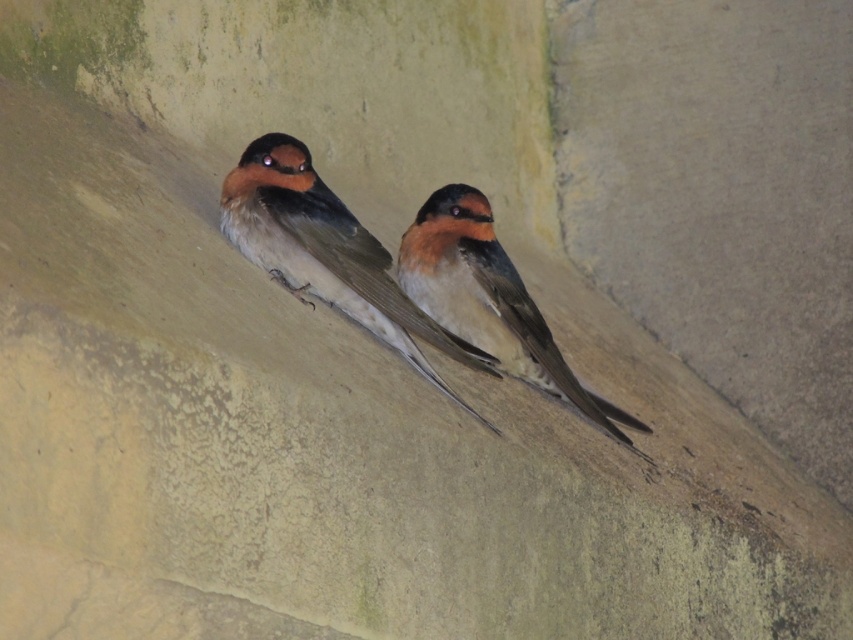
In the scene shown: Is brown feathered swallow at center positioned before brown matte swallow at center?

Yes, it is.

Where is `brown feathered swallow at center`? brown feathered swallow at center is located at coordinates (328, 252).